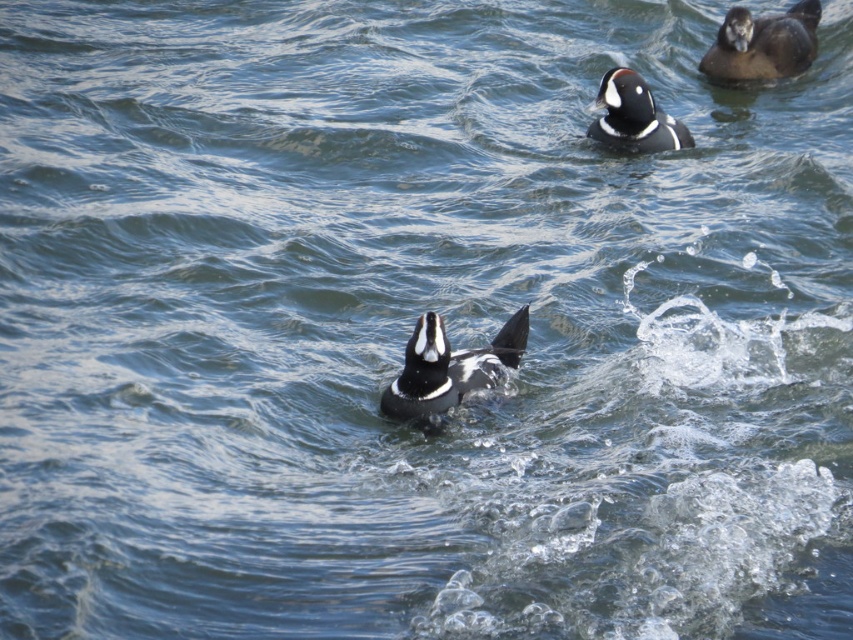
Image resolution: width=853 pixels, height=640 pixels. What do you see at coordinates (448, 369) in the screenshot? I see `black and white duck at center` at bounding box center [448, 369].

Between point (514, 339) and point (602, 116), which one is positioned in front?

Point (514, 339) is in front.

Image resolution: width=853 pixels, height=640 pixels. What are the coordinates of `black and white duck at center` in the screenshot? It's located at (448, 369).

Is black and white duck at center below brown matte duck at upper right?

Yes, black and white duck at center is below brown matte duck at upper right.

Is point (498, 352) positioned after point (703, 58)?

That is False.

Between point (442, 403) and point (805, 49), which one is positioned in front?

Point (442, 403) is more forward.

At what (x,y) coordinates should I click in order to perform the action: click on black and white duck at center. Please return your answer as a coordinate pair (x, y). The height and width of the screenshot is (640, 853). Looking at the image, I should click on (448, 369).

Who is lower down, brown matte duck at upper right or black glossy duck at upper center?

black glossy duck at upper center is lower down.

Between brown matte duck at upper right and black glossy duck at upper center, which one appears on the right side from the viewer's perspective?

brown matte duck at upper right

Who is more forward, (x=801, y=12) or (x=660, y=147)?

Point (x=660, y=147) is more forward.

Identify the location of brown matte duck at upper right. (763, 44).